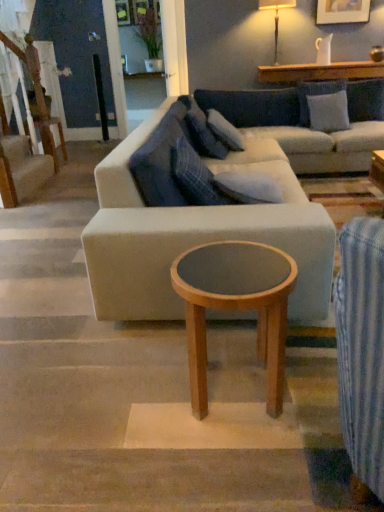
Question: Considering the relative sizes of blue plaid pillow at center, which appears as the third pillow when viewed from the back, and white fabric pillow at upper right, the 4th pillow in the front-to-back sequence, in the image provided, is blue plaid pillow at center, which appears as the third pillow when viewed from the back, shorter than white fabric pillow at upper right, the 4th pillow in the front-to-back sequence,?

Choices:
 (A) yes
 (B) no

Answer: (A)

Question: Is blue plaid pillow at center, which appears as the third pillow when viewed from the back, facing away from white fabric pillow at upper right, which ranks as the 4th pillow in left-to-right order?

Choices:
 (A) yes
 (B) no

Answer: (B)

Question: From the image's perspective, would you say blue plaid pillow at center, positioned as the second pillow in front-to-back order, is positioned over white fabric pillow at upper right, which appears as the first pillow when viewed from the back?

Choices:
 (A) no
 (B) yes

Answer: (A)

Question: Is blue plaid pillow at center, which is counted as the 3th pillow, starting from the right, not close to white fabric pillow at upper right, the 4th pillow in the front-to-back sequence?

Choices:
 (A) yes
 (B) no

Answer: (A)

Question: From a real-world perspective, is blue plaid pillow at center, which appears as the third pillow when viewed from the back, positioned under white fabric pillow at upper right, which ranks as the 4th pillow in left-to-right order, based on gravity?

Choices:
 (A) no
 (B) yes

Answer: (A)

Question: Is white fabric pillow at upper right, which appears as the first pillow when viewed from the back, inside blue plaid pillow at center, positioned as the second pillow in front-to-back order?

Choices:
 (A) yes
 (B) no

Answer: (B)

Question: From a real-world perspective, is light brown wood coffee table at center below wooden round table at left?

Choices:
 (A) yes
 (B) no

Answer: (A)

Question: From the image's perspective, is light brown wood coffee table at center above wooden round table at left?

Choices:
 (A) yes
 (B) no

Answer: (B)

Question: Considering the relative sizes of light brown wood coffee table at center and wooden round table at left in the image provided, is light brown wood coffee table at center bigger than wooden round table at left?

Choices:
 (A) yes
 (B) no

Answer: (A)

Question: Is light brown wood coffee table at center oriented away from wooden round table at left?

Choices:
 (A) no
 (B) yes

Answer: (A)

Question: Is wooden round table at left surrounded by light brown wood coffee table at center?

Choices:
 (A) no
 (B) yes

Answer: (A)

Question: Is light brown wood coffee table at center far from wooden round table at left?

Choices:
 (A) yes
 (B) no

Answer: (A)

Question: From a real-world perspective, is blue plaid pillow at center, which ranks as the 4th pillow in back-to-front order, positioned under light brown wood coffee table at center based on gravity?

Choices:
 (A) no
 (B) yes

Answer: (A)